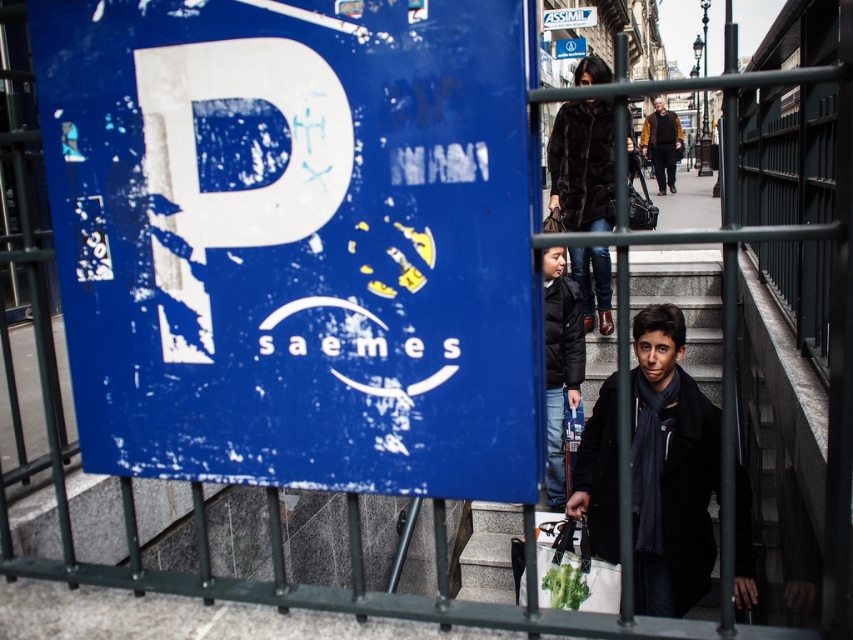
Question: Which point is farther from the camera taking this photo?

Choices:
 (A) (590, 422)
 (B) (583, 10)
 (C) (550, 433)

Answer: (B)

Question: Which point is closer to the camera taking this photo?

Choices:
 (A) (666, 154)
 (B) (589, 314)

Answer: (B)

Question: Can you confirm if blue matte sign at left is wider than blue matte sign at upper center?

Choices:
 (A) no
 (B) yes

Answer: (B)

Question: Which is nearer to the white plastic sign at upper center?

Choices:
 (A) black matte jacket at center
 (B) brown leather jacket at upper center

Answer: (B)

Question: Can you confirm if blue matte sign at left is wider than black fur coat at center?

Choices:
 (A) no
 (B) yes

Answer: (B)

Question: Where is blue matte sign at left located in relation to black matte coat at lower right in the image?

Choices:
 (A) right
 (B) left

Answer: (B)